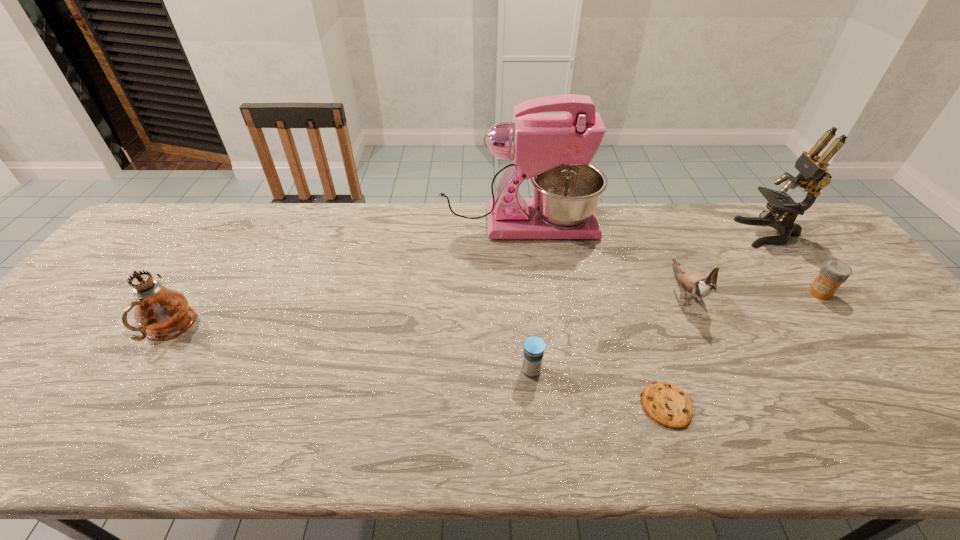
You are a GUI agent. You are given a task and a screenshot of the screen. Output one action in this format:
    pyautogui.click(x=<x>, y=<y>)
    Task: Click on the blank space located on the face of the mixer
    Image resolution: width=960 pixels, height=540 pixels.
    Given the screenshot: What is the action you would take?
    tap(717, 224)

Image resolution: width=960 pixels, height=540 pixels. Find the location of `free location located at the eyepieces of the microscope`. free location located at the eyepieces of the microscope is located at coordinates (710, 233).

Identify the location of vacant point located 0.170m at the eyepieces of the microscope. (688, 233).

At what (x,y) coordinates should I click in order to perform the action: click on vacant space located 0.240m at the eyepieces of the microscope. Please return your answer as a coordinate pair (x, y). This screenshot has height=540, width=960. Looking at the image, I should click on (666, 233).

You are a GUI agent. You are given a task and a screenshot of the screen. Output one action in this format:
    pyautogui.click(x=<x>, y=<y>)
    Task: Click on the vacant space located 0.240m on the back of the leftmost object
    The width and height of the screenshot is (960, 540).
    Given the screenshot: What is the action you would take?
    pyautogui.click(x=221, y=247)

You are a GUI agent. You are given a task and a screenshot of the screen. Output one action in this format:
    pyautogui.click(x=<x>, y=<y>)
    Task: Click on the vacant space located 0.130m at the face of the fifth object from left to right
    
    Given the screenshot: What is the action you would take?
    pyautogui.click(x=720, y=366)

Find the location of `vacant space located 0.370m on the back of the left medicine`. vacant space located 0.370m on the back of the left medicine is located at coordinates (520, 259).

Find the location of a particular element. The image size is (960, 540). free location located 0.080m on the label side of the right medicine is located at coordinates (780, 293).

Locate an element on the screen. free space located on the label side of the right medicine is located at coordinates (688, 293).

At what (x,y) coordinates should I click in order to perform the action: click on free spot located 0.070m on the label side of the right medicine. Please return your answer as a coordinate pair (x, y). This screenshot has height=540, width=960. Looking at the image, I should click on (783, 293).